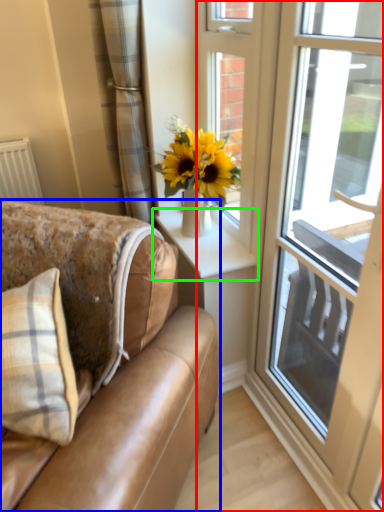
Question: Which object is positioned farthest from window (highlighted by a red box)? Select from studio couch (highlighted by a blue box) and window sill (highlighted by a green box).

Choices:
 (A) studio couch
 (B) window sill

Answer: (A)